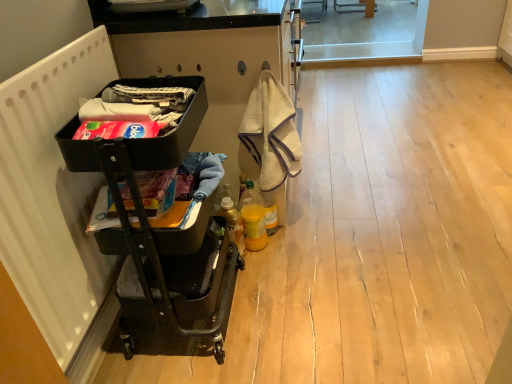
The image size is (512, 384). Identify the location of vacant area that is in front of translucent plastic bottle at lower center, placed as the second bottle when sorted from right to left. (254, 277).